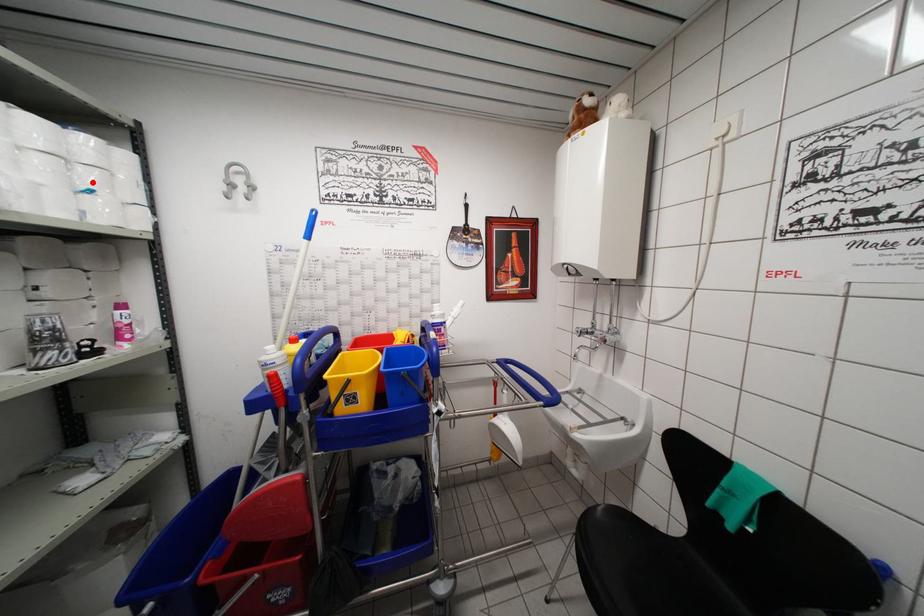
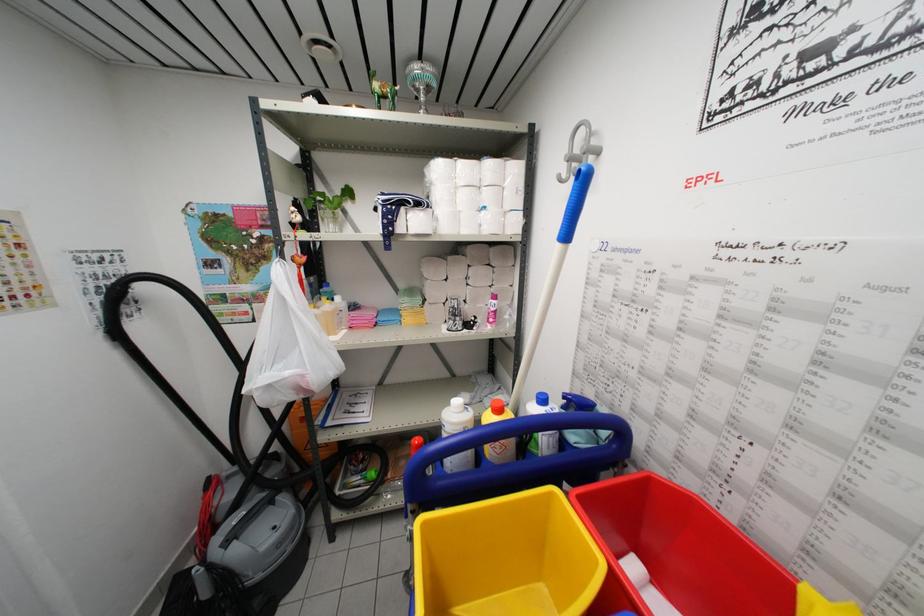
In the second image, find the point that corresponds to the highlighted location in the first image.

(490, 201)